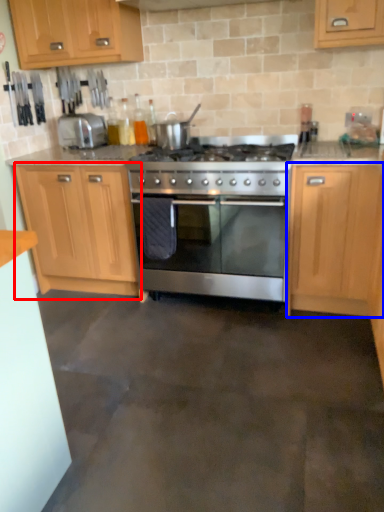
Question: Among these objects, which one is farthest to the camera, cabinetry (highlighted by a red box) or cabinetry (highlighted by a blue box)?

Choices:
 (A) cabinetry
 (B) cabinetry

Answer: (A)